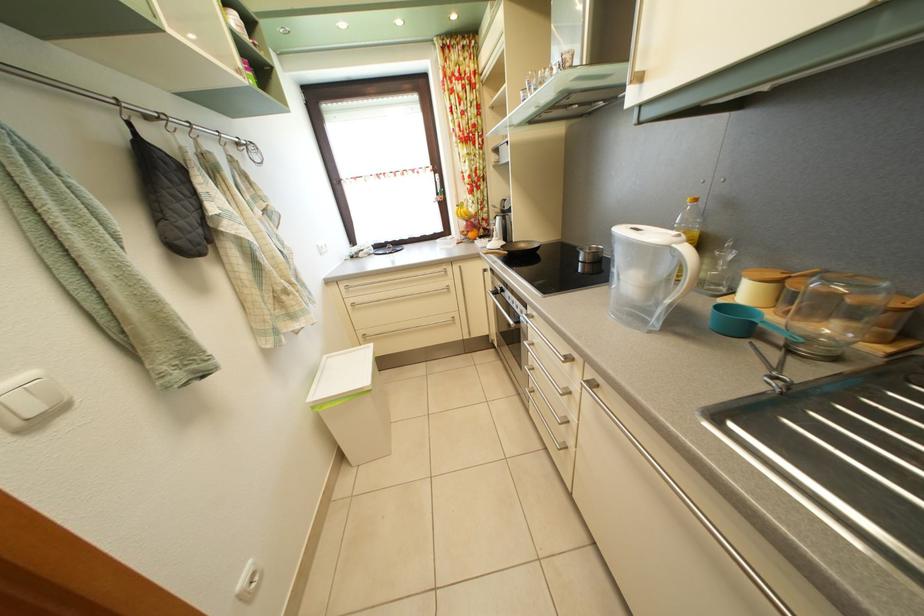
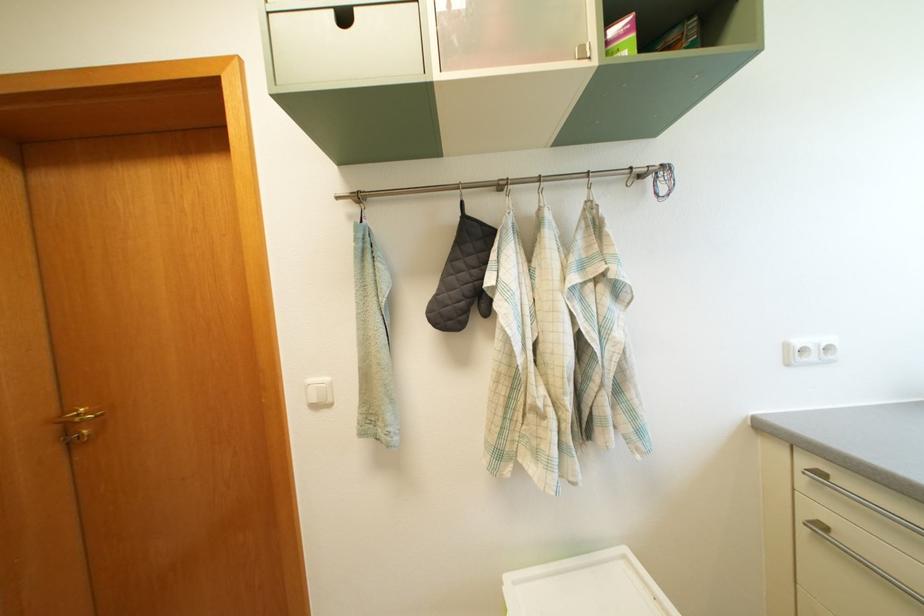
Where in the second image is the point corresponding to [325,254] from the first image?

(795, 353)